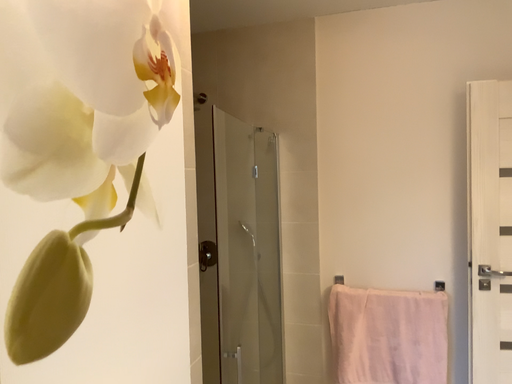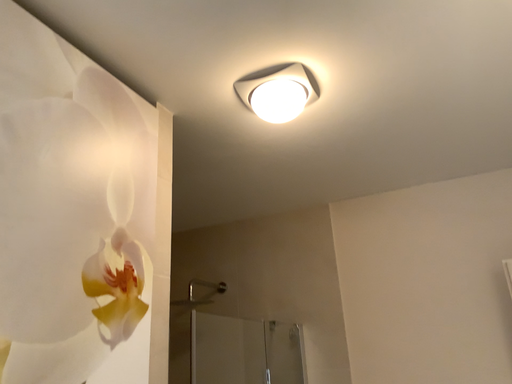
Question: Which way did the camera rotate in the video?

Choices:
 (A) rotated right
 (B) rotated left

Answer: (B)